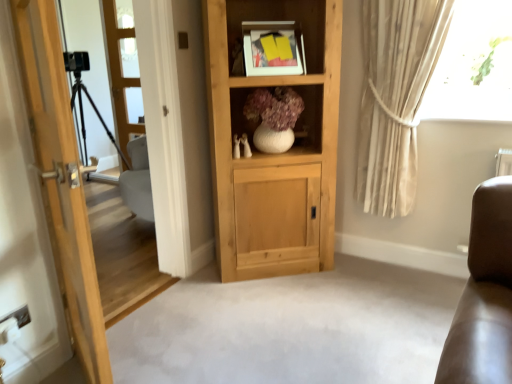
Question: In the image, is light wood door at left positioned in front of or behind matte white picture frame at upper center?

Choices:
 (A) behind
 (B) front

Answer: (B)

Question: Does point (51, 33) appear closer or farther from the camera than point (257, 29)?

Choices:
 (A) farther
 (B) closer

Answer: (B)

Question: Based on their relative distances, which object is nearer to the clear glass door at left, positioned as the 2th screen door in left-to-right order?

Choices:
 (A) light wood door at left
 (B) black matte tripod at left, acting as the 2th screen door starting from the right
 (C) natural wood cabinet at center
 (D) beige fabric curtain at upper right
 (E) matte white picture frame at upper center

Answer: (B)

Question: Which object is positioned closest to the black matte tripod at left, which appears as the 1th screen door when viewed from the left?

Choices:
 (A) natural wood cabinet at center
 (B) beige fabric curtain at upper right
 (C) matte white picture frame at upper center
 (D) white matte vase at center
 (E) light wood door at left

Answer: (E)